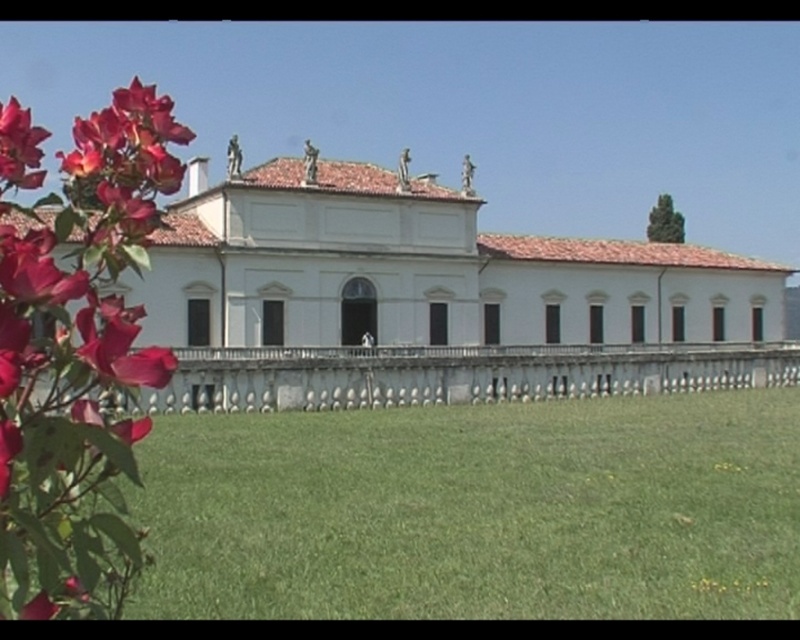
You are standing in front of the building and want to take a photo that includes both the white smooth palace at center and the vibrant red flowers in the foreground. Based on their positions, where should you position yourself to capture both elements in the frame?

Since the white smooth palace at center is positioned at point (428,292), you should position yourself in a spot that allows both the palace and the foreground flowers to be within the camera frame. This likely means standing at a moderate distance where the palace remains visible while the flowers are in the foreground.

You are standing in front of the building and want to see the white smooth palace at center without the matte red petals at left blocking your view. What should you do?

The white smooth palace at center is positioned over the matte red petals at left, so you can move to a higher position or angle to see the palace above the petals.

From the picture: You are a drone operator trying to capture a photo of the white smooth palace at center. The camera is currently positioned at point A, which is at coordinates 0.45, 0.53. To ensure the palace is centered in the frame, should you move the camera slightly to the left or right? Please explain your reasoning based on the coordinates provided.

The white smooth palace at center is located at point (428, 292). The camera is at (424, 288). To center the palace, move the camera slightly to the right and down, as the palace is to the right and above the current position.